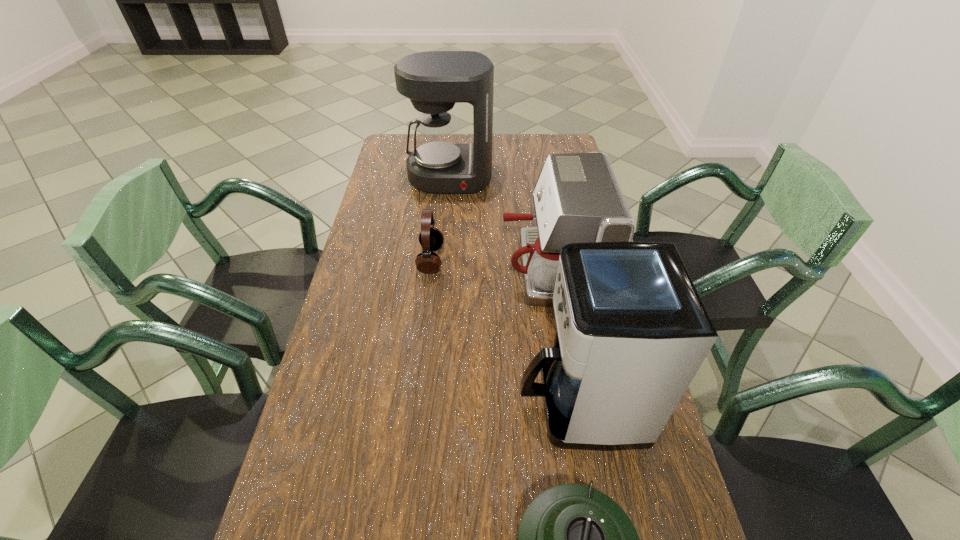
Locate an element on the screen. The height and width of the screenshot is (540, 960). free space that satisfies the following two spatial constraints: 1. on the button side of the farthest object; 2. on the ear pads of the shortest object is located at coordinates point(443,260).

At what (x,y) coordinates should I click in order to perform the action: click on free space that satisfies the following two spatial constraints: 1. on the button side of the farthest coffee maker; 2. on the ear pads of the shortest object. Please return your answer as a coordinate pair (x, y). Looking at the image, I should click on (443, 260).